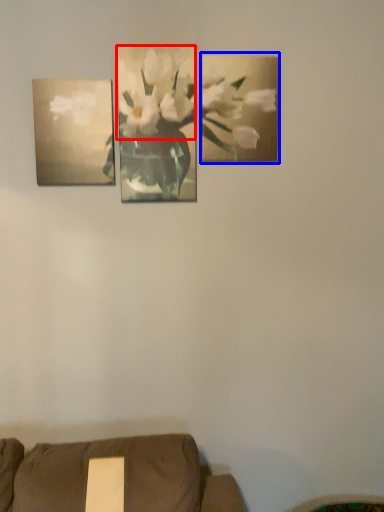
Question: Which of the following is the farthest to the observer, flower (highlighted by a red box) or picture frame (highlighted by a blue box)?

Choices:
 (A) flower
 (B) picture frame

Answer: (B)